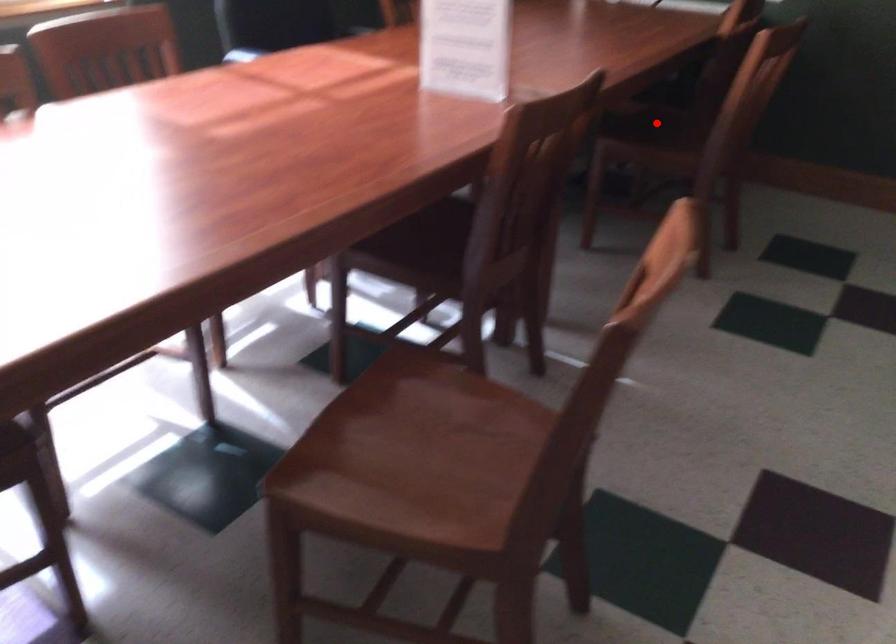
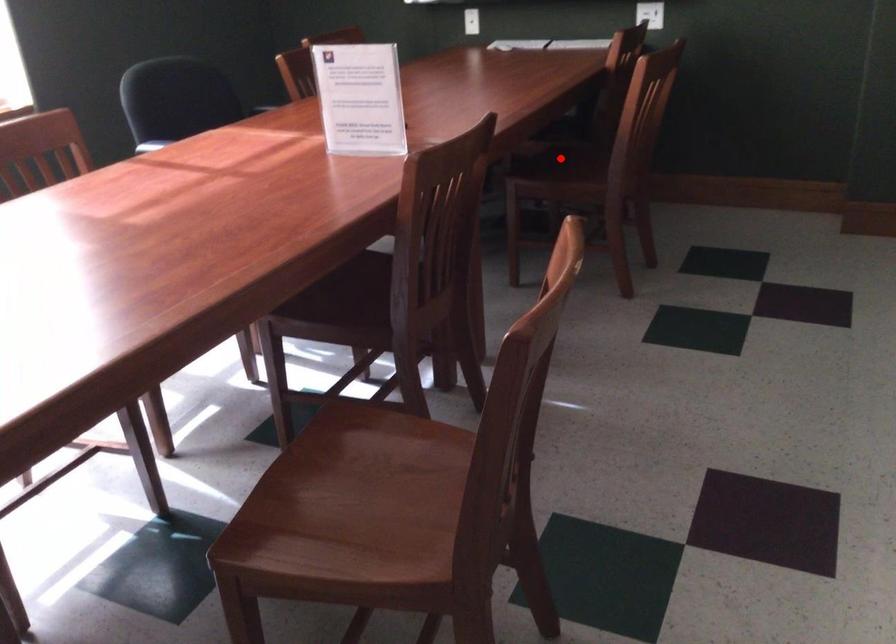
I am providing you with two images of the same scene from different viewpoints. A red point is marked on the first image and another point is marked on the second image. Are the points marked in image1 and image2 representing the same 3D position?

Yes